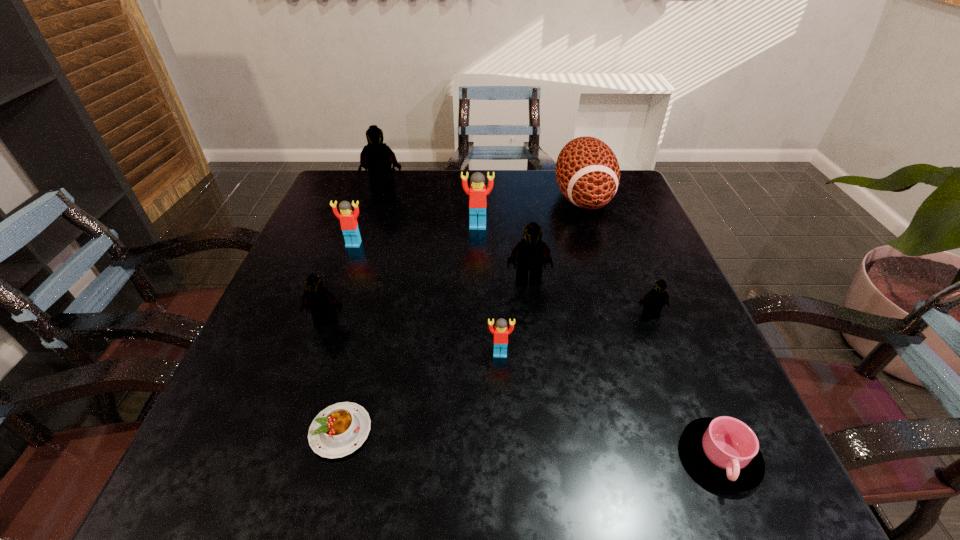
Locate an element on the screen. vacant space situated 0.190m on the face of the second black Lego from right to left is located at coordinates (538, 356).

Find the location of `vacant area situated 0.320m on the face of the fifth nearest Lego`. vacant area situated 0.320m on the face of the fifth nearest Lego is located at coordinates (316, 355).

Locate an element on the screen. This screenshot has width=960, height=540. vacant position located 0.300m on the face of the third biggest black Lego is located at coordinates (271, 481).

Identify the location of vacant space situated 0.200m on the face of the eighth farthest object. (505, 464).

This screenshot has height=540, width=960. I want to click on free region located on the face of the rightmost black Lego, so click(x=693, y=422).

Locate an element on the screen. The image size is (960, 540). free space located 0.350m on the back of the shortest object is located at coordinates (382, 268).

This screenshot has width=960, height=540. I want to click on Lego that is at the far edge, so click(x=376, y=157).

I want to click on football present at the far edge, so click(587, 171).

Locate an element on the screen. The image size is (960, 540). cup that is at the near edge is located at coordinates (724, 451).

I want to click on pudding at the near edge, so click(x=340, y=429).